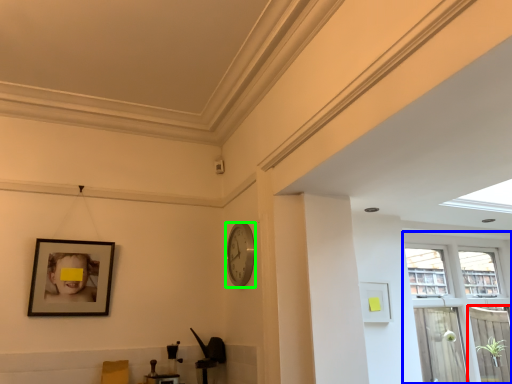
Question: Based on their relative distances, which object is nearer to screen door (highlighted by a red box)? Choose from window (highlighted by a blue box) and clock (highlighted by a green box).

Choices:
 (A) window
 (B) clock

Answer: (A)